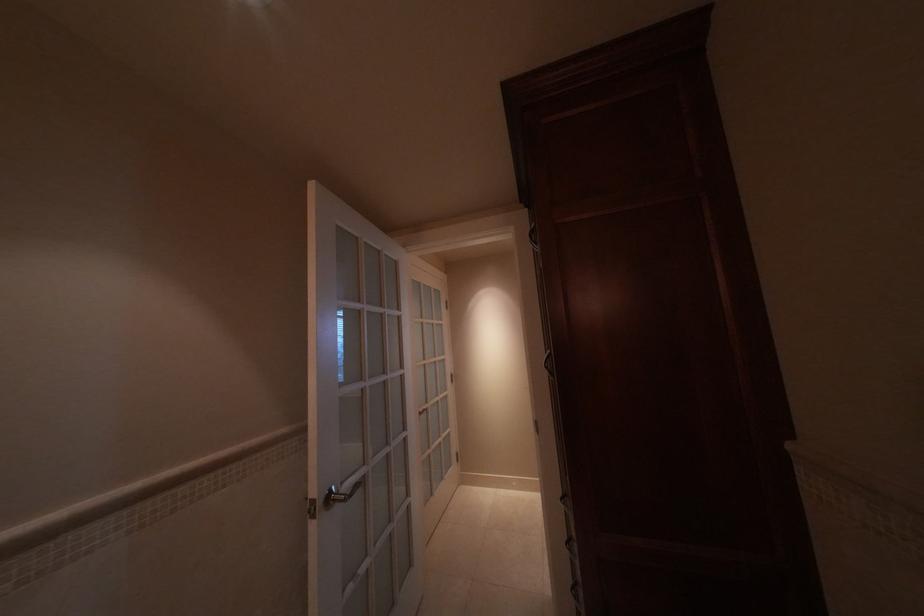
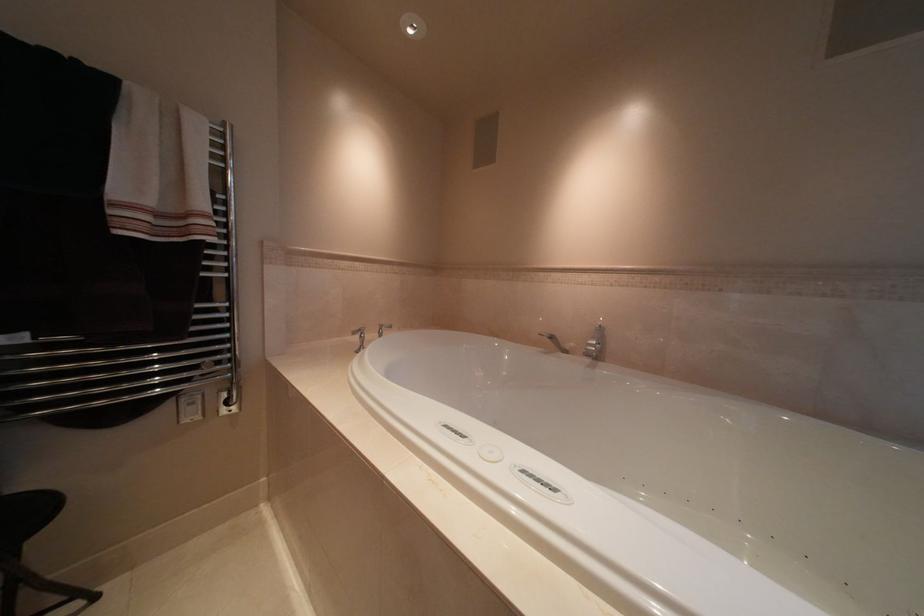
The images are taken continuously from a first-person perspective. In which direction are you moving?

The cameraman walked toward right, forward.